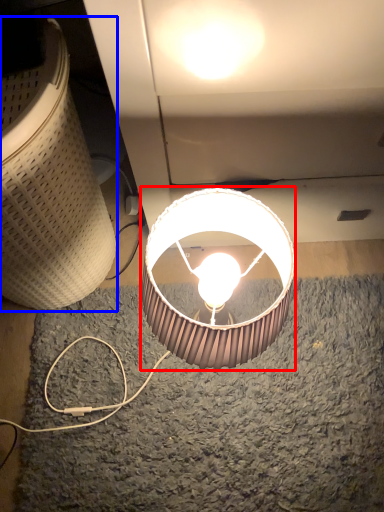
Question: Which of the following is the farthest to the observer, lamp (highlighted by a red box) or lamp (highlighted by a blue box)?

Choices:
 (A) lamp
 (B) lamp

Answer: (A)